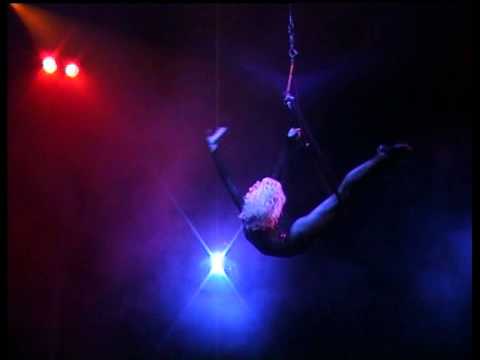
Where is `white light`? The width and height of the screenshot is (480, 360). white light is located at coordinates (213, 266).